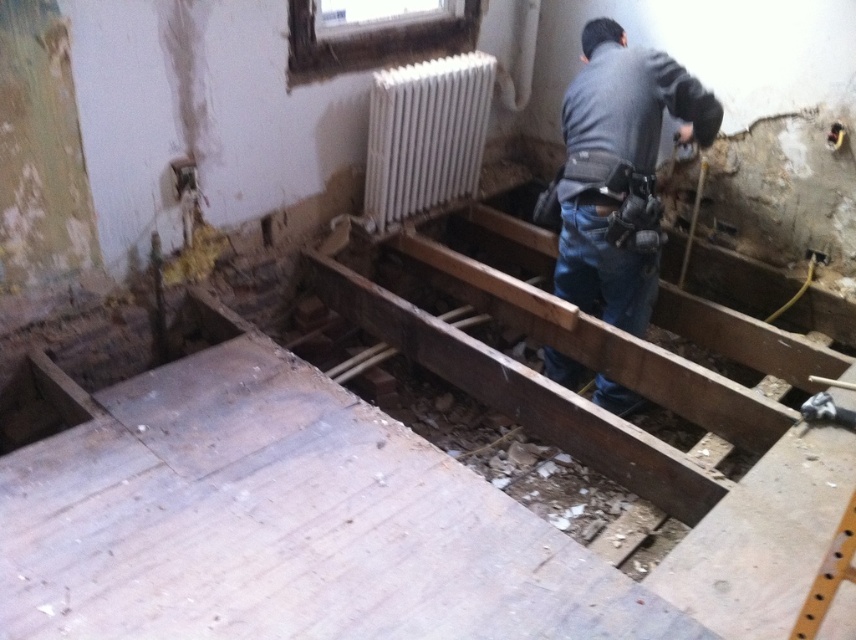
Who is taller, dark gray shirt at center or white metallic radiator at upper center?

With more height is dark gray shirt at center.

Is dark gray shirt at center shorter than white metallic radiator at upper center?

Incorrect, dark gray shirt at center's height does not fall short of white metallic radiator at upper center's.

Who is more distant from viewer, (566,102) or (406,161)?

Positioned behind is point (406,161).

Locate an element on the screen. The image size is (856, 640). dark gray shirt at center is located at coordinates (619, 172).

Does white metallic radiator at upper center lie in front of dark brown wooden hole at lower left?

No, it is not.

Could you measure the distance between white metallic radiator at upper center and dark brown wooden hole at lower left?

white metallic radiator at upper center and dark brown wooden hole at lower left are 1.54 meters apart.

Describe the element at coordinates (425, 134) in the screenshot. I see `white metallic radiator at upper center` at that location.

The width and height of the screenshot is (856, 640). In order to click on white metallic radiator at upper center in this screenshot , I will do `click(425, 134)`.

Is dark gray shirt at center shorter than dark brown wooden hole at lower left?

Incorrect, dark gray shirt at center's height does not fall short of dark brown wooden hole at lower left's.

Can you confirm if dark gray shirt at center is thinner than dark brown wooden hole at lower left?

Incorrect, dark gray shirt at center's width is not less than dark brown wooden hole at lower left's.

Where is `dark gray shirt at center`? The width and height of the screenshot is (856, 640). dark gray shirt at center is located at coordinates (619, 172).